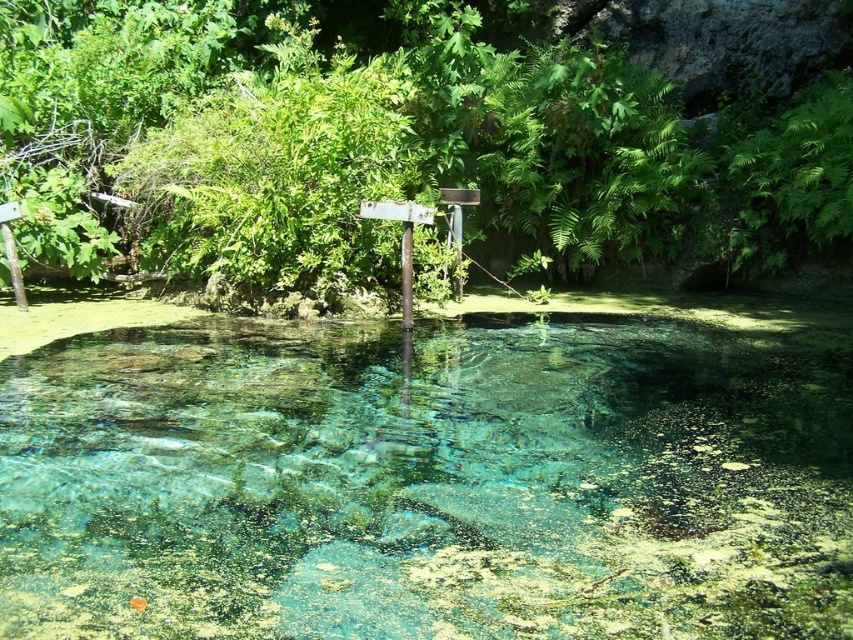
Can you confirm if clear glass pool at center is taller than metallic pole at center?

No.

Can you confirm if clear glass pool at center is positioned above metallic pole at center?

Actually, clear glass pool at center is below metallic pole at center.

Find the location of a particular element. The image size is (853, 640). clear glass pool at center is located at coordinates (428, 481).

Is point (782, 1) closer to viewer compared to point (402, 228)?

No.

Describe the element at coordinates (419, 132) in the screenshot. This screenshot has height=640, width=853. I see `green leafy tree at center` at that location.

You are a GUI agent. You are given a task and a screenshot of the screen. Output one action in this format:
    pyautogui.click(x=<x>, y=<y>)
    Task: Click on the green leafy tree at center
    The height and width of the screenshot is (640, 853).
    Given the screenshot: What is the action you would take?
    pyautogui.click(x=419, y=132)

Between clear glass pool at center and green leafy tree at center, which one appears on the left side from the viewer's perspective?

green leafy tree at center

Which is in front, point (489, 348) or point (715, 49)?

Point (489, 348) is more forward.

At what (x,y) coordinates should I click in order to perform the action: click on clear glass pool at center. Please return your answer as a coordinate pair (x, y). The height and width of the screenshot is (640, 853). Looking at the image, I should click on (428, 481).

This screenshot has height=640, width=853. I want to click on clear glass pool at center, so click(428, 481).